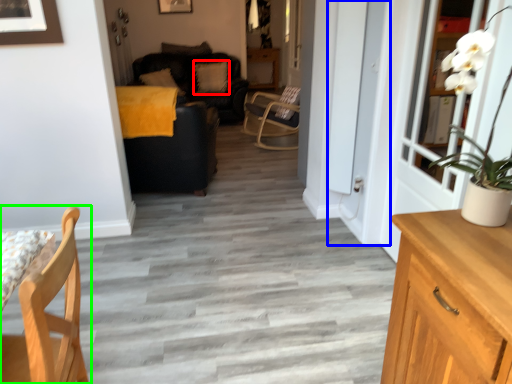
Question: Based on their relative distances, which object is farther from pillow (highlighted by a red box)? Choose from screen door (highlighted by a blue box) and chair (highlighted by a green box).

Choices:
 (A) screen door
 (B) chair

Answer: (B)